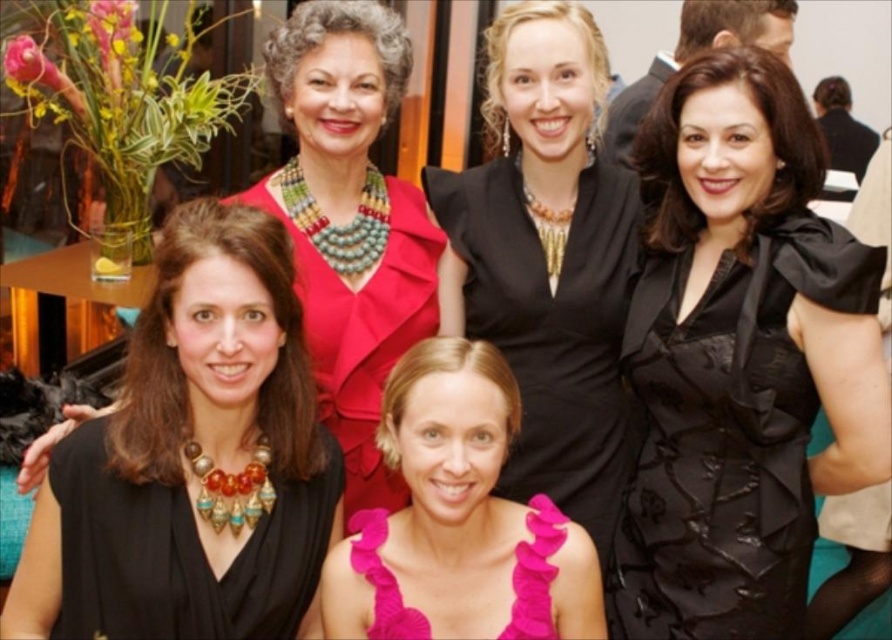
Question: Which object is closer to the camera taking this photo?

Choices:
 (A) matte black dress at center
 (B) black satin dress at upper center
 (C) fuchsia textured fabric dress at center

Answer: (A)

Question: Among these points, which one is nearest to the camera?

Choices:
 (A) (15, 605)
 (B) (593, 580)
 (C) (692, 502)
 (D) (339, 316)

Answer: (A)

Question: From the image, what is the correct spatial relationship of black satin dress at center in relation to shiny red dress at center?

Choices:
 (A) right
 (B) left

Answer: (A)

Question: Which point is farther from the camera taking this photo?

Choices:
 (A) [x=87, y=483]
 (B) [x=255, y=349]

Answer: (B)

Question: Is the position of black satin dress at upper center more distant than that of pink satin dress at center?

Choices:
 (A) yes
 (B) no

Answer: (A)

Question: Is black satin dress at center thinner than shiny red dress at center?

Choices:
 (A) no
 (B) yes

Answer: (A)